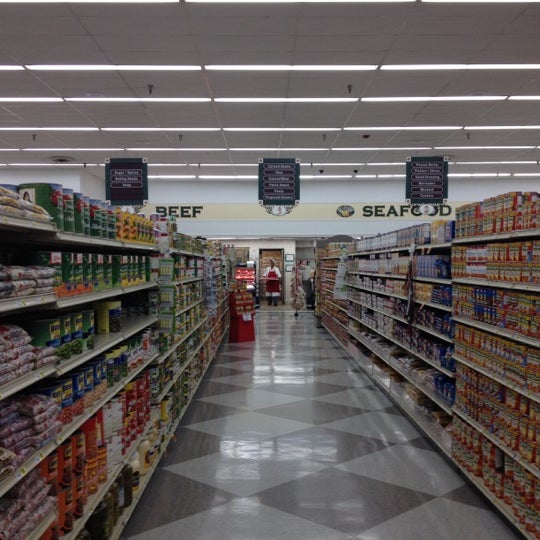
This screenshot has height=540, width=540. Identify the location of floor. (293, 383).